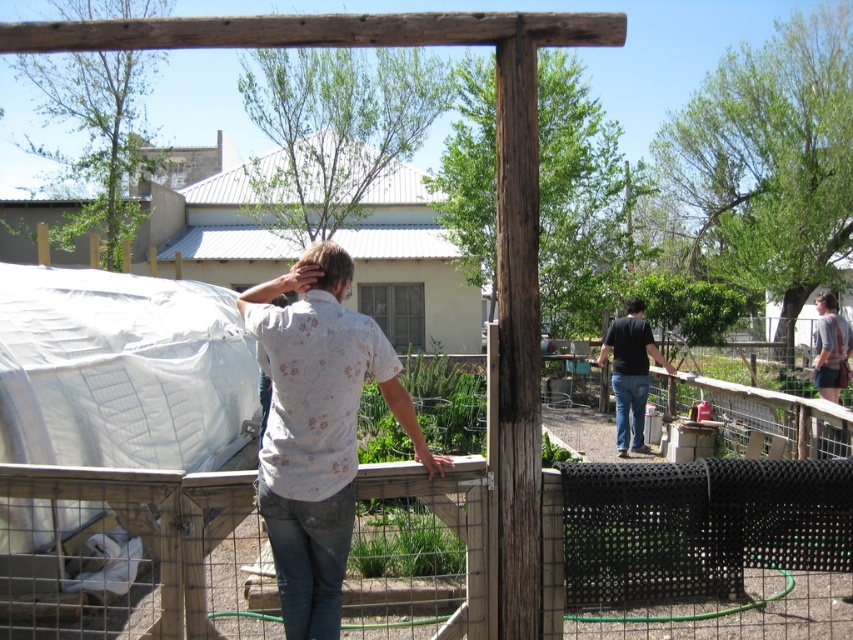
Question: Can you confirm if floral shirt at center is smaller than striped shirt at upper right?

Choices:
 (A) yes
 (B) no

Answer: (A)

Question: Which object appears closest to the camera in this image?

Choices:
 (A) striped shirt at upper right
 (B) floral shirt at center
 (C) black matte shirt at right

Answer: (B)

Question: Does floral shirt at center have a lesser width compared to striped shirt at upper right?

Choices:
 (A) no
 (B) yes

Answer: (B)

Question: Where is floral shirt at center located in relation to striped shirt at upper right in the image?

Choices:
 (A) right
 (B) left

Answer: (B)

Question: Which object is the farthest from the black matte shirt at right?

Choices:
 (A) striped shirt at upper right
 (B) floral shirt at center

Answer: (B)

Question: Estimate the real-world distances between objects in this image. Which object is closer to the floral shirt at center?

Choices:
 (A) black matte shirt at right
 (B) striped shirt at upper right

Answer: (B)